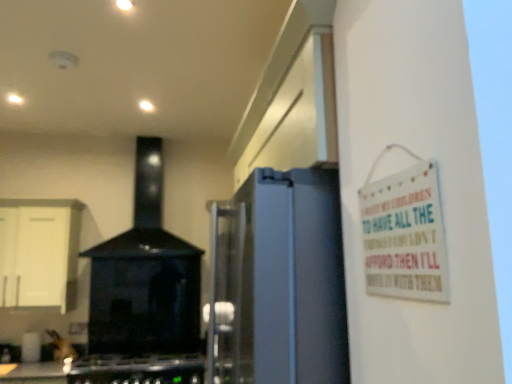
Question: Does white wooden sign at upper right appear on the left side of black glossy stove at center?

Choices:
 (A) yes
 (B) no

Answer: (B)

Question: Is white wooden sign at upper right completely or partially outside of black glossy stove at center?

Choices:
 (A) yes
 (B) no

Answer: (A)

Question: Considering the relative sizes of white wooden sign at upper right and black glossy stove at center in the image provided, is white wooden sign at upper right smaller than black glossy stove at center?

Choices:
 (A) yes
 (B) no

Answer: (A)

Question: Is white wooden sign at upper right positioned in front of black glossy stove at center?

Choices:
 (A) yes
 (B) no

Answer: (A)

Question: From the image's perspective, would you say white wooden sign at upper right is shown under black glossy stove at center?

Choices:
 (A) no
 (B) yes

Answer: (B)

Question: From a real-world perspective, does white wooden sign at upper right stand above black glossy stove at center?

Choices:
 (A) yes
 (B) no

Answer: (B)

Question: Does white matte cabinet at left have a lesser width compared to black matte gas stove at lower left?

Choices:
 (A) no
 (B) yes

Answer: (B)

Question: Considering the relative positions of white matte cabinet at left and black matte gas stove at lower left in the image provided, is white matte cabinet at left to the right of black matte gas stove at lower left from the viewer's perspective?

Choices:
 (A) yes
 (B) no

Answer: (B)

Question: Is white matte cabinet at left aimed at black matte gas stove at lower left?

Choices:
 (A) yes
 (B) no

Answer: (B)

Question: Considering the relative positions of white matte cabinet at left and black matte gas stove at lower left in the image provided, is white matte cabinet at left to the left of black matte gas stove at lower left from the viewer's perspective?

Choices:
 (A) no
 (B) yes

Answer: (B)

Question: Is there a large distance between white matte cabinet at left and black matte gas stove at lower left?

Choices:
 (A) yes
 (B) no

Answer: (B)

Question: From the image's perspective, is white matte cabinet at left on black matte gas stove at lower left?

Choices:
 (A) no
 (B) yes

Answer: (B)

Question: Does black glossy stove at center lie in front of black matte gas stove at lower left?

Choices:
 (A) no
 (B) yes

Answer: (A)